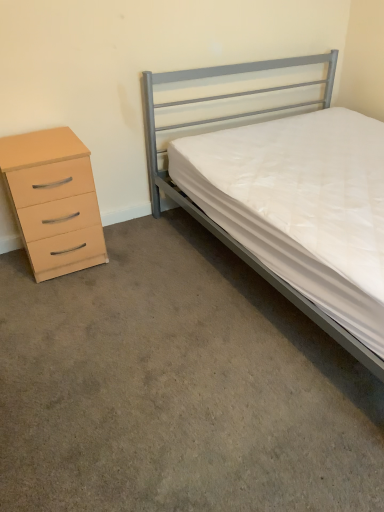
Question: From the image's perspective, is beige matte chest of drawers at left located above carpet at lower left?

Choices:
 (A) no
 (B) yes

Answer: (B)

Question: Does beige matte chest of drawers at left have a lesser width compared to carpet at lower left?

Choices:
 (A) yes
 (B) no

Answer: (A)

Question: Can you confirm if beige matte chest of drawers at left is positioned to the left of carpet at lower left?

Choices:
 (A) yes
 (B) no

Answer: (A)

Question: Is beige matte chest of drawers at left wider than carpet at lower left?

Choices:
 (A) no
 (B) yes

Answer: (A)

Question: Is beige matte chest of drawers at left further to the viewer compared to carpet at lower left?

Choices:
 (A) no
 (B) yes

Answer: (B)

Question: Is carpet at lower left spatially inside metallic gray bed at right, or outside of it?

Choices:
 (A) outside
 (B) inside

Answer: (A)

Question: From their relative heights in the image, would you say carpet at lower left is taller or shorter than metallic gray bed at right?

Choices:
 (A) short
 (B) tall

Answer: (A)

Question: Is carpet at lower left wider or thinner than metallic gray bed at right?

Choices:
 (A) wide
 (B) thin

Answer: (B)

Question: Is carpet at lower left bigger or smaller than metallic gray bed at right?

Choices:
 (A) small
 (B) big

Answer: (A)

Question: Considering the relative positions of beige matte chest of drawers at left and carpet at lower left in the image provided, is beige matte chest of drawers at left to the left or to the right of carpet at lower left?

Choices:
 (A) left
 (B) right

Answer: (A)

Question: From a real-world perspective, is beige matte chest of drawers at left above or below carpet at lower left?

Choices:
 (A) above
 (B) below

Answer: (A)

Question: In terms of height, does beige matte chest of drawers at left look taller or shorter compared to carpet at lower left?

Choices:
 (A) tall
 (B) short

Answer: (A)

Question: In the image, is beige matte chest of drawers at left positioned in front of or behind carpet at lower left?

Choices:
 (A) front
 (B) behind

Answer: (B)

Question: In terms of height, does carpet at lower left look taller or shorter compared to beige matte chest of drawers at left?

Choices:
 (A) short
 (B) tall

Answer: (A)

Question: Is point (76, 432) positioned closer to the camera than point (43, 155)?

Choices:
 (A) farther
 (B) closer

Answer: (B)